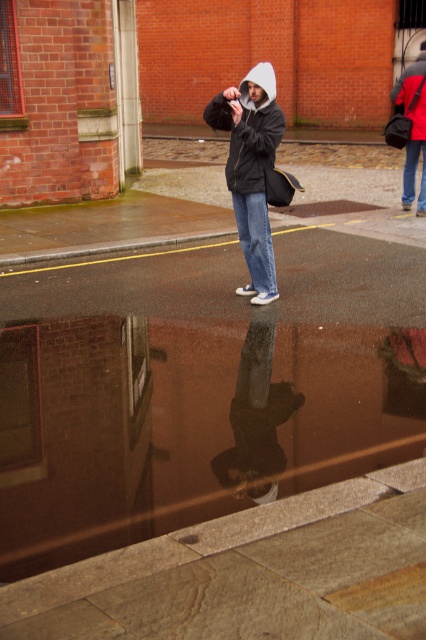
Question: Which point is farther to the camera?

Choices:
 (A) blue denim jeans at lower right
 (B) shiny asphalt pavement at center
 (C) matte black bag at upper right
 (D) matte black jacket at center

Answer: (A)

Question: Observing the image, what is the correct spatial positioning of denim jeans at center in reference to blue denim jeans at lower right?

Choices:
 (A) below
 (B) above

Answer: (A)

Question: Which point appears closest to the camera in this image?

Choices:
 (A) (423, 189)
 (B) (405, 109)
 (C) (98, 476)

Answer: (C)

Question: Can you confirm if matte black jacket at center is positioned below denim jeans at center?

Choices:
 (A) yes
 (B) no

Answer: (B)

Question: Which object appears closest to the camera in this image?

Choices:
 (A) shiny asphalt pavement at center
 (B) blue denim jeans at lower right
 (C) matte black jacket at center

Answer: (A)

Question: Does smooth black jacket at center have a smaller size compared to matte black jacket at center?

Choices:
 (A) yes
 (B) no

Answer: (B)